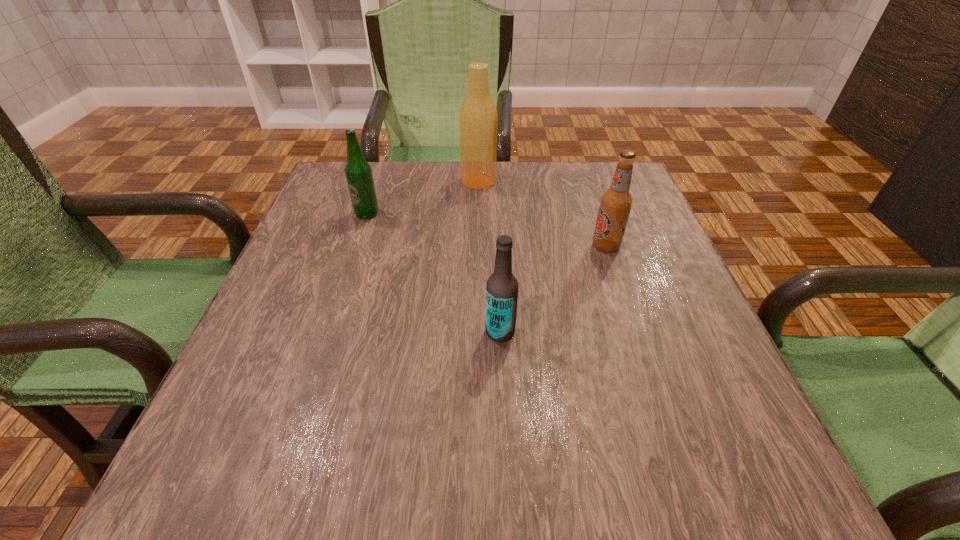
Where is `the farthest object`? This screenshot has width=960, height=540. the farthest object is located at coordinates (478, 118).

Where is `the tallest beer bottle`? the tallest beer bottle is located at coordinates (478, 118).

The image size is (960, 540). In order to click on the second nearest beer bottle in this screenshot , I will do `click(616, 202)`.

The width and height of the screenshot is (960, 540). I want to click on the second nearest object, so click(616, 202).

Where is `the nearest object`? the nearest object is located at coordinates (502, 286).

At what (x,y) coordinates should I click in order to perform the action: click on the second farthest beer bottle. Please return your answer as a coordinate pair (x, y). Looking at the image, I should click on (358, 171).

Find the location of a particular element. The height and width of the screenshot is (540, 960). the third nearest object is located at coordinates (358, 171).

This screenshot has height=540, width=960. In order to click on free location located on the front of the tallest beer bottle in this screenshot , I will do (x=478, y=252).

Identify the location of vacant region located 0.320m on the front label of the second nearest beer bottle. This screenshot has height=540, width=960. (447, 246).

The width and height of the screenshot is (960, 540). What are the coordinates of `vacant space located on the front label of the second nearest beer bottle` in the screenshot? It's located at (533, 246).